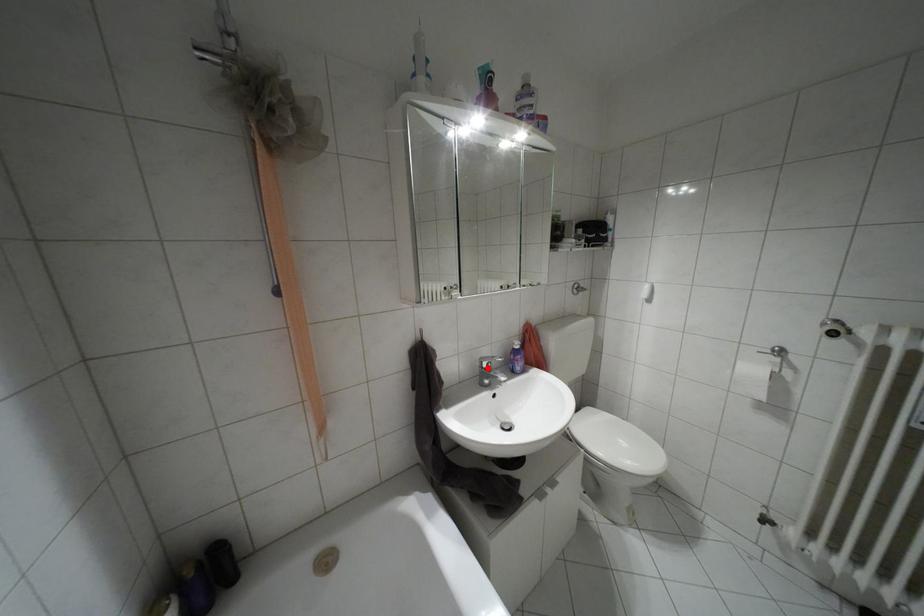
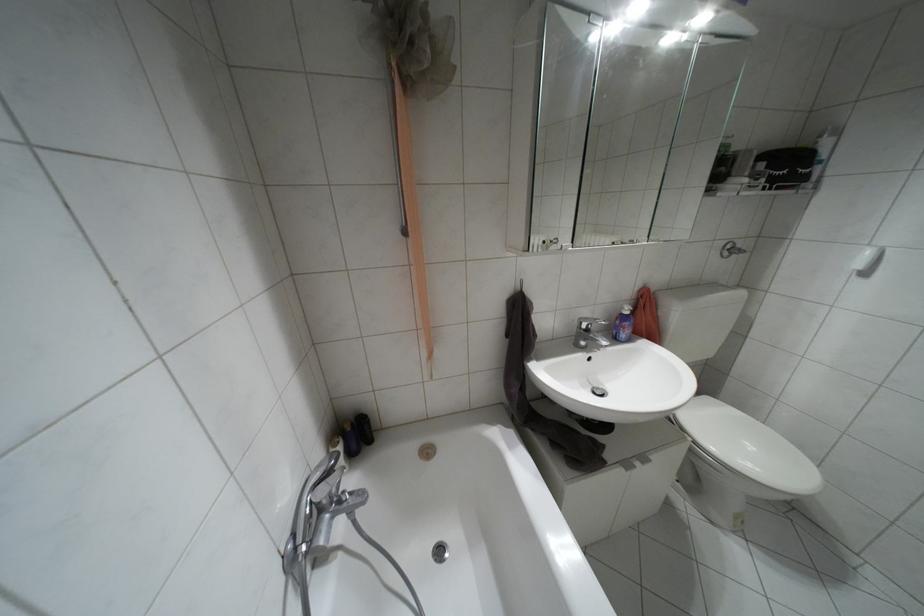
In the second image, find the point that corresponds to the highlighted location in the first image.

(587, 330)